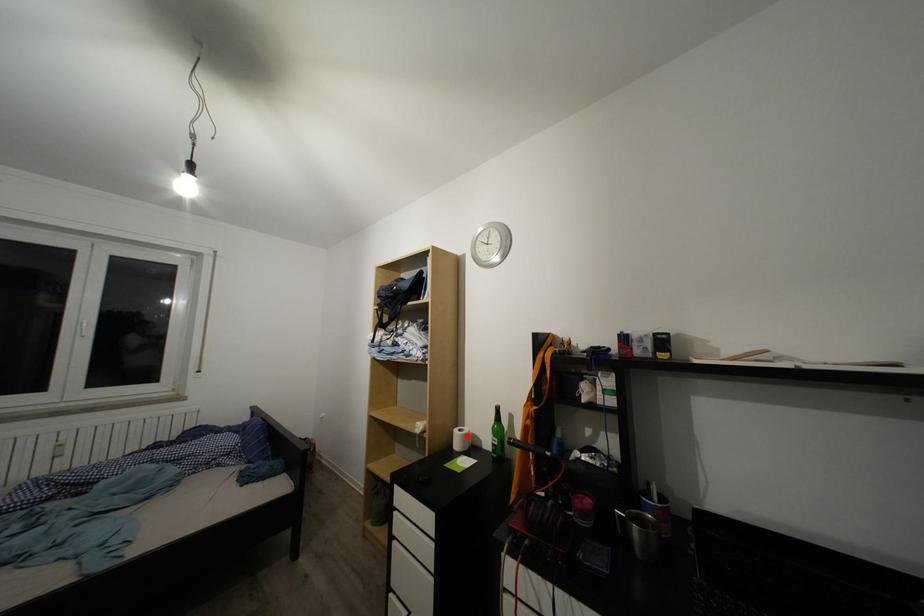
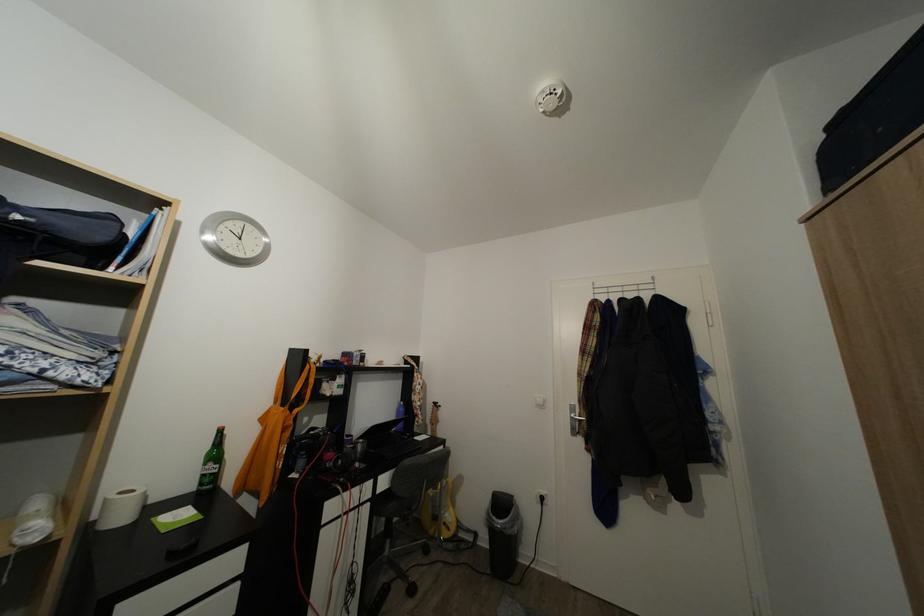
Question: I am providing you with two images of the same scene from different viewpoints. A red point is shown in image1. For the corresponding object point in image2, is it positioned nearer or farther from the camera?

Choices:
 (A) Nearer
 (B) Farther

Answer: (A)